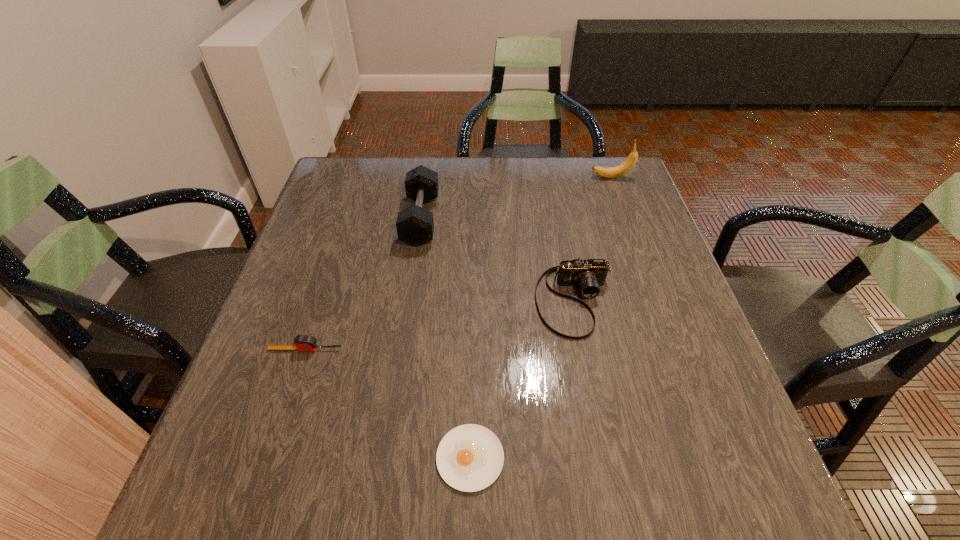
Choose which object is the third nearest neighbor to the rightmost object. Please provide its 2D coordinates. Your answer should be formatted as a tuple, i.e. [(x, y)], where the tuple contains the x and y coordinates of a point satisfying the conditions above.

[(470, 457)]

Where is `the closest object to the dumbbell`? the closest object to the dumbbell is located at coordinates (589, 274).

Find the location of `vacant space that satisfies the following two spatial constraints: 1. at the start of the peel on the tallest object; 2. on the front-facing side of the third farthest object`. vacant space that satisfies the following two spatial constraints: 1. at the start of the peel on the tallest object; 2. on the front-facing side of the third farthest object is located at coordinates (658, 301).

Find the location of `vacant position in the image that satisfies the following two spatial constraints: 1. at the start of the peel on the farthest object; 2. on the front-facing side of the third shortest object`. vacant position in the image that satisfies the following two spatial constraints: 1. at the start of the peel on the farthest object; 2. on the front-facing side of the third shortest object is located at coordinates (658, 301).

Identify the location of free location that satisfies the following two spatial constraints: 1. at the start of the peel on the banana; 2. on the front side of the nearest object. (715, 458).